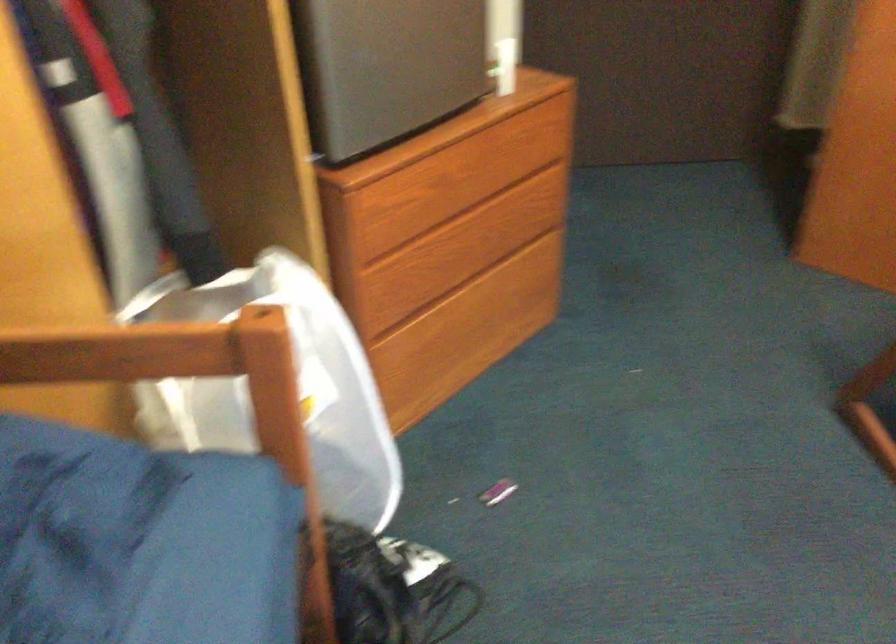
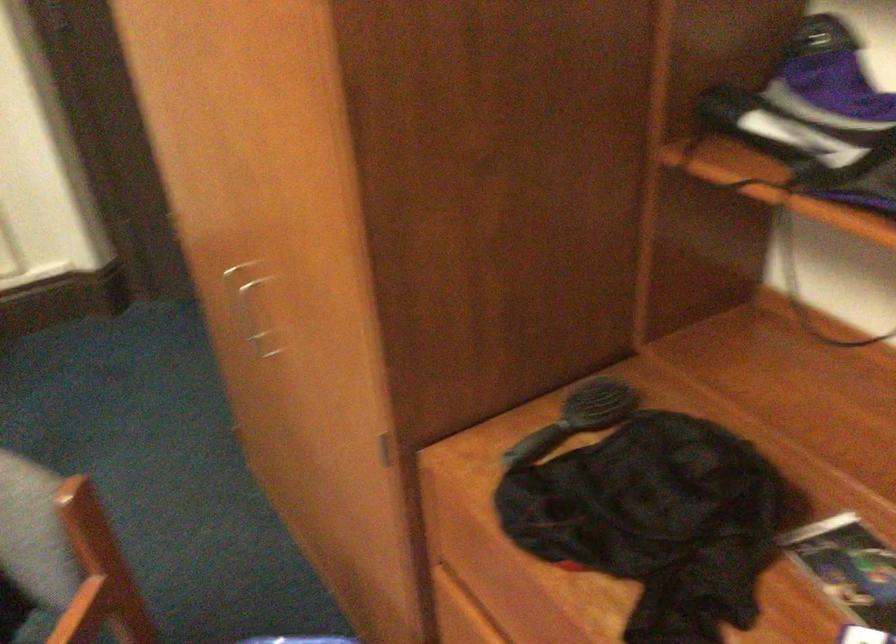
Question: What movement of the cameraman would produce the second image?

Choices:
 (A) Left
 (B) Right
 (C) Forward
 (D) Backward

Answer: (B)